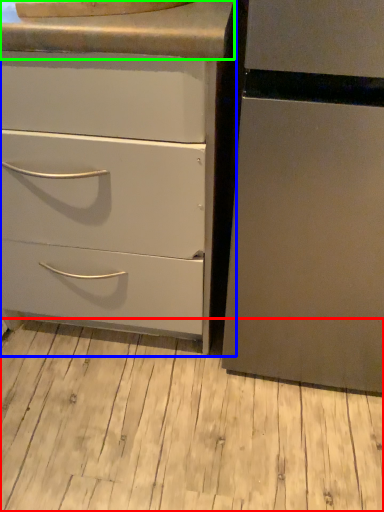
Question: Considering the real-world distances, which object is closest to plank (highlighted by a red box)? chest of drawers (highlighted by a blue box) or counter top (highlighted by a green box).

Choices:
 (A) chest of drawers
 (B) counter top

Answer: (A)